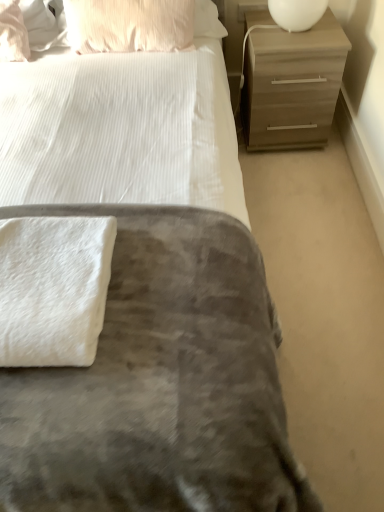
You are a GUI agent. You are given a task and a screenshot of the screen. Output one action in this format:
    pyautogui.click(x=<x>, y=<y>)
    Task: Click on the free space in front of matte brown chest of drawers at upper right
    
    Given the screenshot: What is the action you would take?
    pyautogui.click(x=297, y=181)